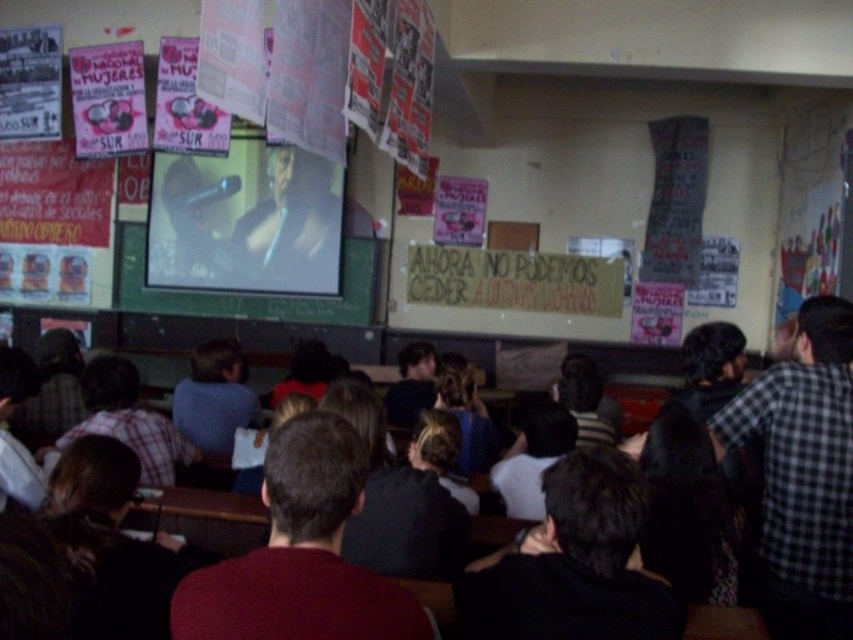
From the picture: Does dark red shirt at center appear under checkered fabric shirt at right?

No.

Does dark red shirt at center have a greater height compared to checkered fabric shirt at right?

Incorrect, dark red shirt at center's height is not larger of checkered fabric shirt at right's.

Is point (265, 547) closer to camera compared to point (751, 385)?

Yes, it is in front of point (751, 385).

You are a GUI agent. You are given a task and a screenshot of the screen. Output one action in this format:
    pyautogui.click(x=<x>, y=<y>)
    Task: Click on the dark red shirt at center
    
    Given the screenshot: What is the action you would take?
    pyautogui.click(x=300, y=554)

Based on the photo, which is more to the right, checkered fabric shirt at right or matte pink poster at upper left?

From the viewer's perspective, checkered fabric shirt at right appears more on the right side.

Between point (798, 388) and point (73, 113), which one is positioned in front?

Point (798, 388) is more forward.

I want to click on checkered fabric shirt at right, so click(x=802, y=474).

Does point (206, 598) lie in front of point (338, 193)?

Yes, it is.

This screenshot has height=640, width=853. What do you see at coordinates (300, 554) in the screenshot? I see `dark red shirt at center` at bounding box center [300, 554].

Image resolution: width=853 pixels, height=640 pixels. Describe the element at coordinates (300, 554) in the screenshot. I see `dark red shirt at center` at that location.

Locate an element on the screen. dark red shirt at center is located at coordinates (300, 554).